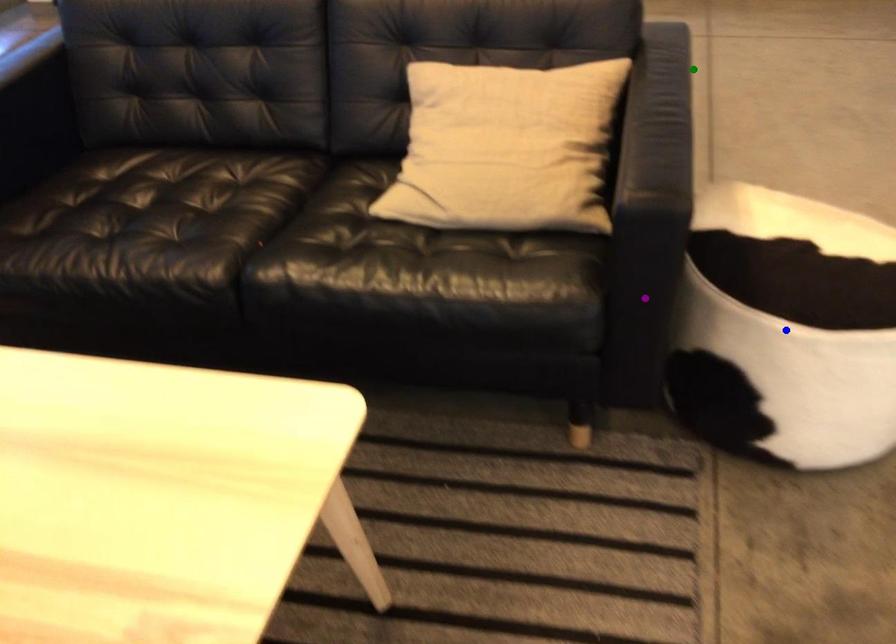
Looking at this image, order these from nearest to farthest:
blue point | purple point | green point

1. purple point
2. blue point
3. green point